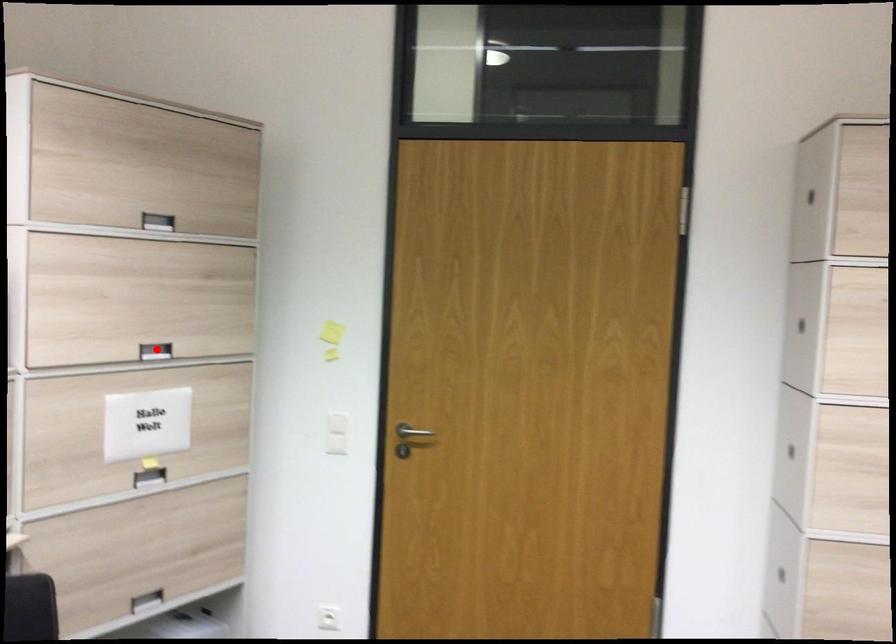
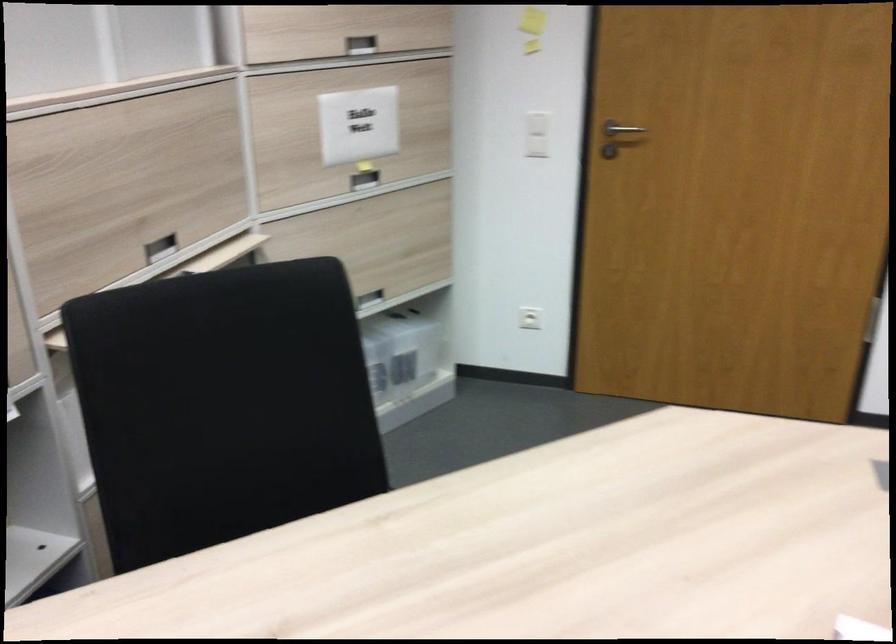
The point at the highlighted location is marked in the first image. Where is the corresponding point in the second image?

(360, 44)